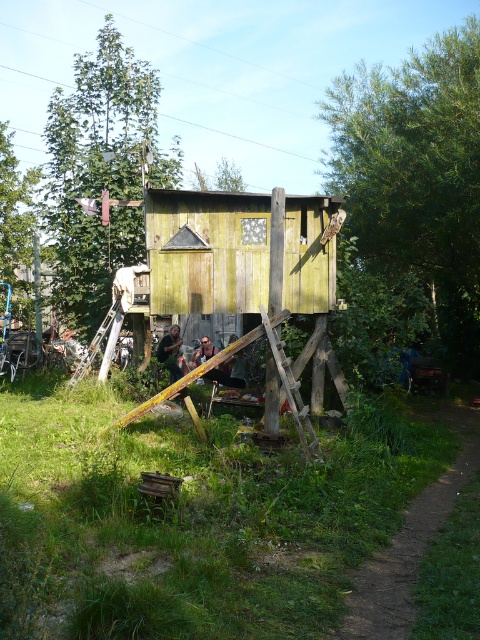
This screenshot has height=640, width=480. What do you see at coordinates (206, 259) in the screenshot?
I see `green weathered wood hut at center` at bounding box center [206, 259].

Which is in front, point (236, 268) or point (8, 176)?

Point (236, 268) is more forward.

Locate an element on the screen. Image resolution: width=480 pixels, height=640 pixels. green weathered wood hut at center is located at coordinates (206, 259).

Which is more to the right, green grass at lower center or green leafy tree at upper left?

From the viewer's perspective, green grass at lower center appears more on the right side.

Based on the photo, does green grass at lower center appear under green leafy tree at upper left?

Correct, green grass at lower center is located below green leafy tree at upper left.

Does point (57, 531) come closer to viewer compared to point (58, 253)?

Yes, it is in front of point (58, 253).

Where is `green grass at lower center`? The width and height of the screenshot is (480, 640). green grass at lower center is located at coordinates (193, 518).

What do you see at coordinates (193, 518) in the screenshot? The image size is (480, 640). I see `green grass at lower center` at bounding box center [193, 518].

Measure the distance from green grass at lower center to green wood tree at upper left.

The distance of green grass at lower center from green wood tree at upper left is 13.32 meters.

Between point (229, 536) and point (24, 232), which one is positioned behind?

The point (24, 232) is behind.

You are a GUI agent. You are given a task and a screenshot of the screen. Output one action in this format:
    pyautogui.click(x=<x>, y=<y>)
    Task: Click on the green grass at lower center
    
    Given the screenshot: What is the action you would take?
    pyautogui.click(x=193, y=518)